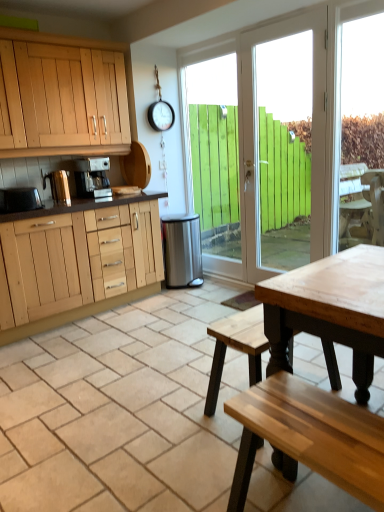
The image size is (384, 512). Find the location of `white wood door at center`. white wood door at center is located at coordinates (273, 151).

At what (x,y) coordinates should I click in order to perform the action: click on brushed metal kettle at left, which is the 2th appliance from left to right. Please return your answer as a coordinate pair (x, y). This screenshot has width=384, height=512. Looking at the image, I should click on (59, 186).

What do you see at coordinates (19, 200) in the screenshot? I see `metallic silver toaster at left, arranged as the 1th appliance when viewed from the front` at bounding box center [19, 200].

Locate an element on the screen. The image size is (384, 512). white wood door at center is located at coordinates (273, 151).

Is white wood door at center completely or partially outside of satin silver coffee maker at center?

Yes, white wood door at center is located beyond the bounds of satin silver coffee maker at center.

Considering the relative sizes of white wood door at center and satin silver coffee maker at center in the image provided, is white wood door at center taller than satin silver coffee maker at center?

Indeed, white wood door at center has a greater height compared to satin silver coffee maker at center.

Is white wood door at center further to the viewer compared to satin silver coffee maker at center?

No, the depth of white wood door at center is less than that of satin silver coffee maker at center.

Image resolution: width=384 pixels, height=512 pixels. I want to click on door below the satin silver coffee maker at center (from the image's perspective), so click(x=273, y=151).

Does point (82, 177) come farther from viewer compared to point (67, 186)?

That is True.

From a real-world perspective, which is physically below, satin silver coffee maker at center or brushed metal kettle at left, the 2th appliance viewed from the front?

brushed metal kettle at left, the 2th appliance viewed from the front.

Visually, is satin silver coffee maker at center positioned to the left or to the right of brushed metal kettle at left, arranged as the second appliance when viewed from the back?

In the image, satin silver coffee maker at center appears on the right side of brushed metal kettle at left, arranged as the second appliance when viewed from the back.

Where is `the 1st appliance in front of the satin silver coffee maker at center, counting from the anchor's position`? the 1st appliance in front of the satin silver coffee maker at center, counting from the anchor's position is located at coordinates (x=59, y=186).

Is brushed metal kettle at left, the 2th appliance from the right, far from satin silver coffee maker at center?

brushed metal kettle at left, the 2th appliance from the right, is near satin silver coffee maker at center, not far away.

From the image's perspective, relative to satin silver coffee maker at center, is brushed metal kettle at left, arranged as the second appliance when viewed from the back, above or below?

Clearly, from the image's perspective, brushed metal kettle at left, arranged as the second appliance when viewed from the back, is below satin silver coffee maker at center.

Is brushed metal kettle at left, arranged as the second appliance when viewed from the back, oriented towards satin silver coffee maker at center?

No, brushed metal kettle at left, arranged as the second appliance when viewed from the back, is not aimed at satin silver coffee maker at center.

Is white wood door at center turned away from brushed metal kettle at left, the 2th appliance viewed from the front?

No.

Which object is more forward, white wood door at center or brushed metal kettle at left, the 2th appliance viewed from the front?

Positioned in front is white wood door at center.

Who is shorter, white wood door at center or brushed metal kettle at left, the 2th appliance from the right?

Standing shorter between the two is brushed metal kettle at left, the 2th appliance from the right.

From the image's perspective, which one is positioned lower, white wood door at center or brushed metal kettle at left, the 2th appliance viewed from the front?

brushed metal kettle at left, the 2th appliance viewed from the front, is shown below in the image.

Is satin silver coffee maker at center bigger than metallic silver toaster at left, the 1th appliance viewed from the left?

Correct, satin silver coffee maker at center is larger in size than metallic silver toaster at left, the 1th appliance viewed from the left.

Could you measure the distance between satin silver coffee maker at center and metallic silver toaster at left, acting as the 3th appliance starting from the back?

satin silver coffee maker at center is 25.10 inches from metallic silver toaster at left, acting as the 3th appliance starting from the back.

Find the location of a particular element. coffee maker on the right side of metallic silver toaster at left, arranged as the 1th appliance when viewed from the front is located at coordinates (92, 177).

From the image's perspective, is satin silver coffee maker at center located beneath metallic silver toaster at left, the 1th appliance viewed from the left?

No, from the image's perspective, satin silver coffee maker at center is not below metallic silver toaster at left, the 1th appliance viewed from the left.

Is brushed metal kettle at left, the 2th appliance viewed from the front, far from white wood door at center?

Yes.

In terms of size, does brushed metal kettle at left, the 2th appliance from the right, appear bigger or smaller than white wood door at center?

brushed metal kettle at left, the 2th appliance from the right, is smaller than white wood door at center.

Would you say brushed metal kettle at left, arranged as the second appliance when viewed from the back, is outside white wood door at center?

Yes.

Does stainless steel trash can at center, which ranks as the third appliance in front-to-back order, turn towards satin silver coffee maker at center?

No, stainless steel trash can at center, which ranks as the third appliance in front-to-back order, is not oriented towards satin silver coffee maker at center.

Does stainless steel trash can at center, which ranks as the third appliance in front-to-back order, appear on the right side of satin silver coffee maker at center?

Correct, you'll find stainless steel trash can at center, which ranks as the third appliance in front-to-back order, to the right of satin silver coffee maker at center.

Which point is more distant from viewer, (x=192, y=279) or (x=82, y=163)?

Positioned behind is point (x=192, y=279).

Can you confirm if stainless steel trash can at center, which is the first appliance from right to left, is smaller than satin silver coffee maker at center?

No.

The image size is (384, 512). What are the coordinates of `door in front of the satin silver coffee maker at center` in the screenshot? It's located at (273, 151).

In the image, there is a brushed metal kettle at left, which is the 2th appliance from left to right. Identify the location of coffee maker above it (from the image's perspective). (92, 177).

Estimate the real-world distances between objects in this image. Which object is further from stainless steel trash can at center, the 3th appliance from the left, brushed metal kettle at left, arranged as the second appliance when viewed from the back, or white wood door at center?

brushed metal kettle at left, arranged as the second appliance when viewed from the back, is positioned further to the anchor stainless steel trash can at center, the 3th appliance from the left.

Estimate the real-world distances between objects in this image. Which object is further from metallic silver toaster at left, the 1th appliance viewed from the left, stainless steel trash can at center, which ranks as the third appliance in front-to-back order, or brushed metal kettle at left, the 2th appliance from the right?

stainless steel trash can at center, which ranks as the third appliance in front-to-back order, is positioned further to the anchor metallic silver toaster at left, the 1th appliance viewed from the left.

Looking at the image, which one is located further to satin silver coffee maker at center, stainless steel trash can at center, which is the first appliance from right to left, or white wood door at center?

The object further to satin silver coffee maker at center is white wood door at center.

Considering their positions, is stainless steel trash can at center, which is the first appliance from right to left, positioned closer to satin silver coffee maker at center than brushed metal kettle at left, the 2th appliance from the right?

The object closer to satin silver coffee maker at center is brushed metal kettle at left, the 2th appliance from the right.

Estimate the real-world distances between objects in this image. Which object is closer to white wood door at center, stainless steel trash can at center, the 3th appliance from the left, or brushed metal kettle at left, the 2th appliance from the right?

stainless steel trash can at center, the 3th appliance from the left, is closer to white wood door at center.

Based on their spatial positions, is satin silver coffee maker at center or stainless steel trash can at center, the 3th appliance from the left, further from brushed metal kettle at left, the 2th appliance viewed from the front?

stainless steel trash can at center, the 3th appliance from the left, lies further to brushed metal kettle at left, the 2th appliance viewed from the front, than the other object.

Which object lies nearer to the anchor point metallic silver toaster at left, acting as the 3th appliance starting from the back, white wood door at center or stainless steel trash can at center, which ranks as the first appliance in back-to-front order?

stainless steel trash can at center, which ranks as the first appliance in back-to-front order.

Considering their positions, is satin silver coffee maker at center positioned further to metallic silver toaster at left, acting as the 3th appliance starting from the back, than brushed metal kettle at left, which is the 2th appliance from left to right?

satin silver coffee maker at center.

Where is `appliance located between satin silver coffee maker at center and white wood door at center in the left-right direction`? appliance located between satin silver coffee maker at center and white wood door at center in the left-right direction is located at coordinates (182, 251).

Identify the location of coffee maker between brushed metal kettle at left, the 2th appliance from the right, and white wood door at center from left to right. The image size is (384, 512). (92, 177).

Where is `appliance located between metallic silver toaster at left, the 1th appliance viewed from the left, and stainless steel trash can at center, the 3th appliance from the left, in the left-right direction`? appliance located between metallic silver toaster at left, the 1th appliance viewed from the left, and stainless steel trash can at center, the 3th appliance from the left, in the left-right direction is located at coordinates (59, 186).

The image size is (384, 512). I want to click on coffee maker between brushed metal kettle at left, the 2th appliance viewed from the front, and stainless steel trash can at center, which ranks as the first appliance in back-to-front order, from left to right, so click(92, 177).